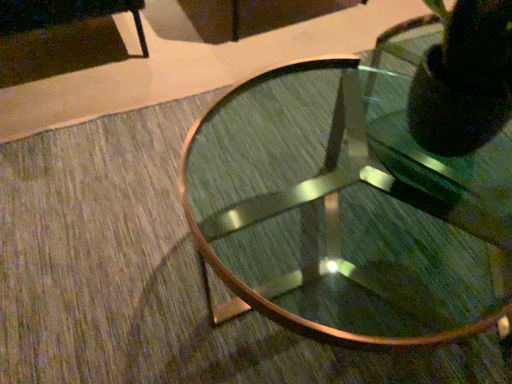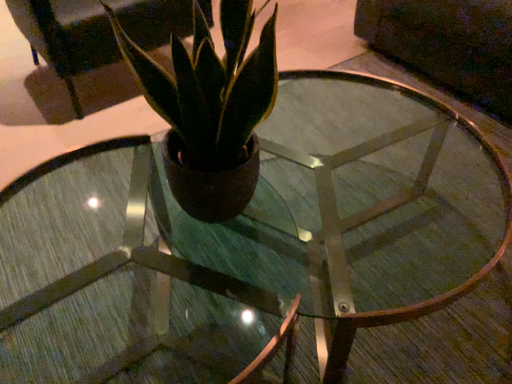
Question: Which way did the camera rotate in the video?

Choices:
 (A) rotated left
 (B) rotated right

Answer: (B)